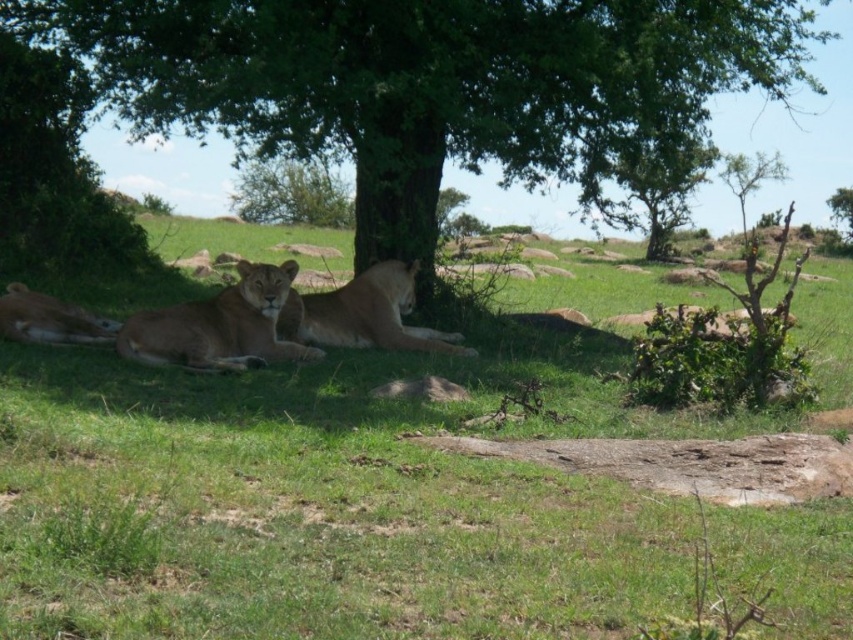
Question: Is brown fur lion at center below brown fur lion at lower left?

Choices:
 (A) no
 (B) yes

Answer: (B)

Question: Does green grass at center appear on the right side of brown fur lion at lower left?

Choices:
 (A) no
 (B) yes

Answer: (B)

Question: Among these points, which one is farthest from the camera?

Choices:
 (A) (741, 509)
 (B) (59, 323)

Answer: (B)

Question: Is the position of green leafy tree at center more distant than that of brown fur lion at lower left?

Choices:
 (A) yes
 (B) no

Answer: (B)

Question: Which object appears farthest from the camera in this image?

Choices:
 (A) brown fur lion at lower left
 (B) green grass at center

Answer: (A)

Question: Which point is farther to the camera?

Choices:
 (A) brown fur lion at center
 (B) green grass at center

Answer: (A)